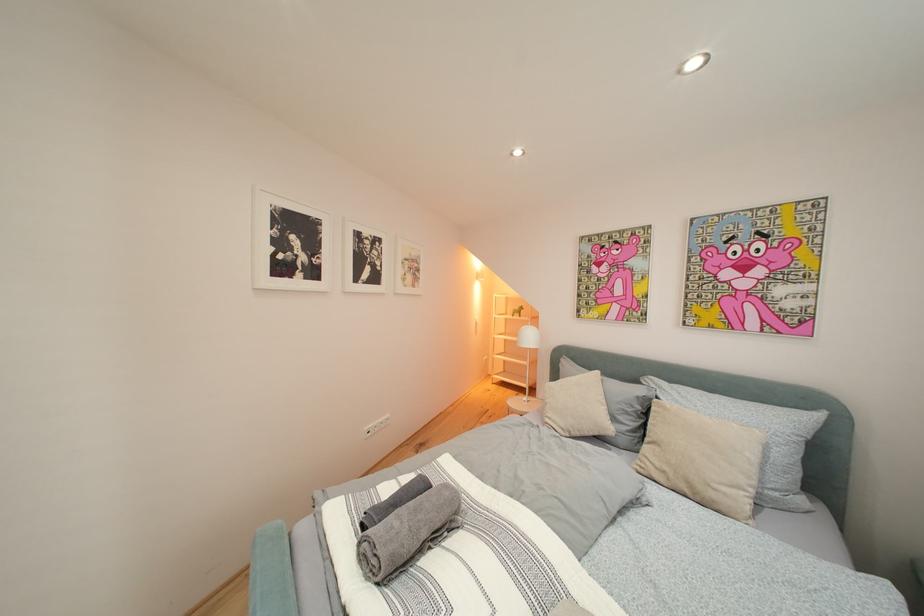
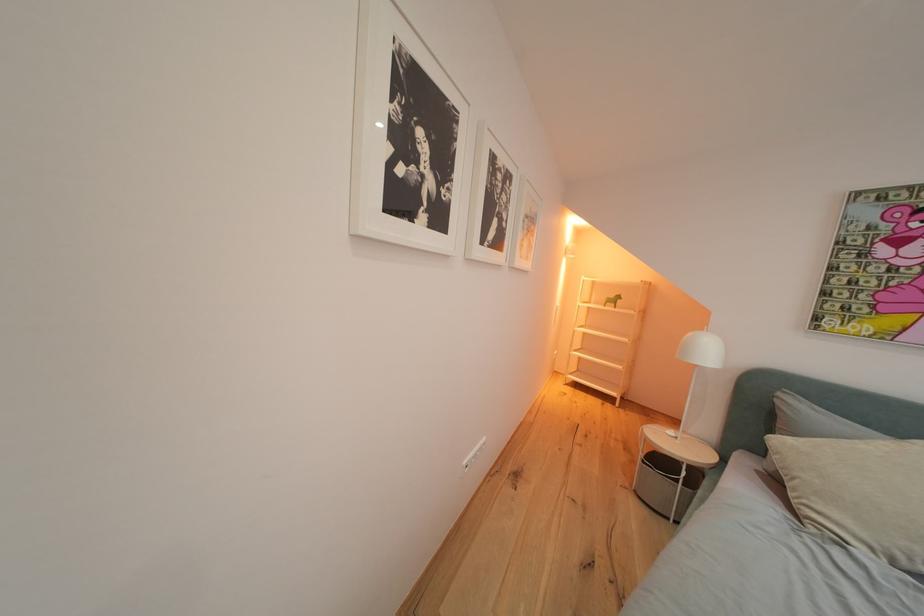
In a continuous first-person perspective shot, in which direction is the camera moving?

The movement direction of the cameraman is left, forward.